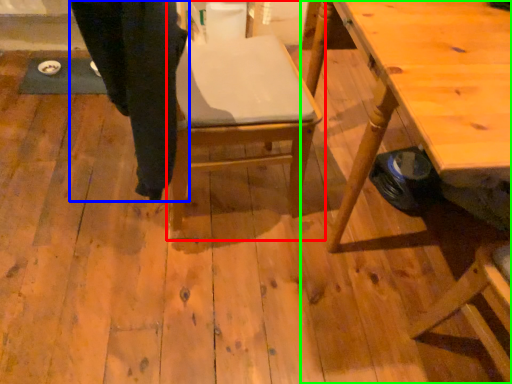
Question: Which object is the closest to the chair (highlighted by a red box)? Choose among these: trousers (highlighted by a blue box) or table (highlighted by a green box).

Choices:
 (A) trousers
 (B) table

Answer: (A)